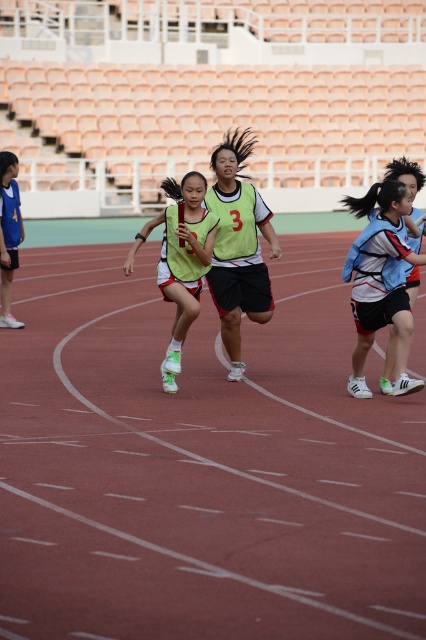
Question: Which of the following is the farthest from the observer?

Choices:
 (A) (137, 433)
 (B) (402, 291)
 (C) (157, 220)

Answer: (C)

Question: Which point appears farthest from the camera in this image?

Choices:
 (A) (163, 237)
 (B) (89, 630)

Answer: (A)

Question: Among these points, which one is farthest from the camera?

Choices:
 (A) (391, 452)
 (B) (207, 228)
 (C) (365, 253)

Answer: (B)

Question: Is the position of red rubber track at center more distant than that of light blue jersey at center?

Choices:
 (A) yes
 (B) no

Answer: (B)

Question: Is the position of red rubber track at center more distant than that of light blue jersey at center?

Choices:
 (A) yes
 (B) no

Answer: (B)

Question: Is the position of light blue jersey at center less distant than that of green matte jersey at center?

Choices:
 (A) yes
 (B) no

Answer: (A)